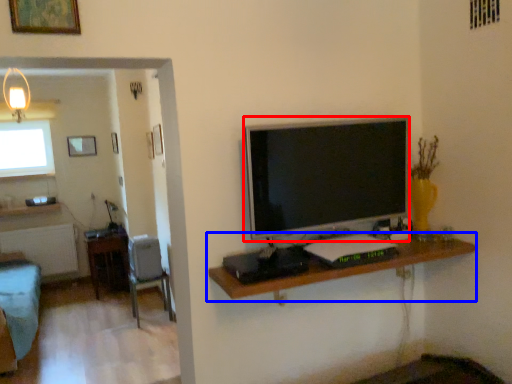
Question: Which point is further to the camera, television (highlighted by a red box) or shelf (highlighted by a blue box)?

Choices:
 (A) television
 (B) shelf

Answer: (A)